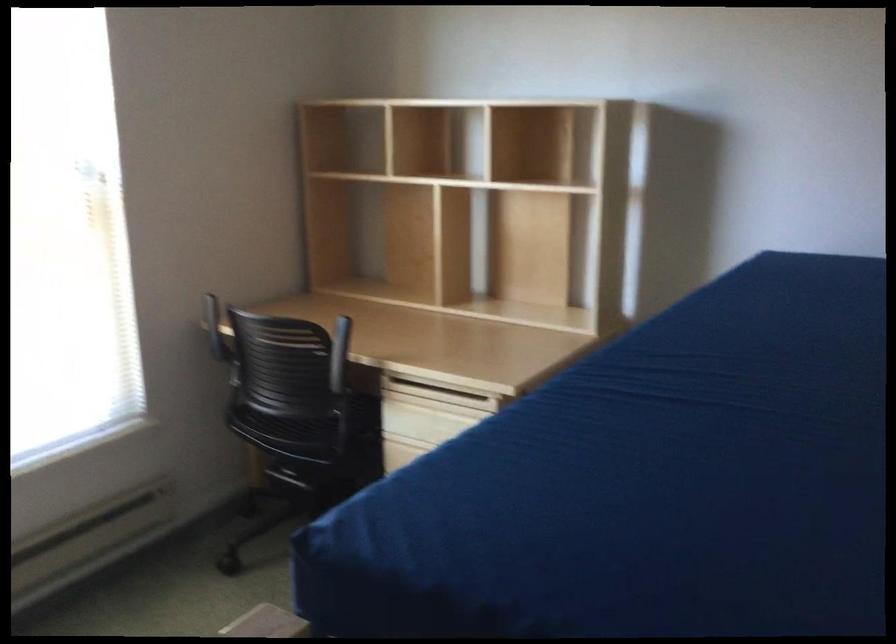
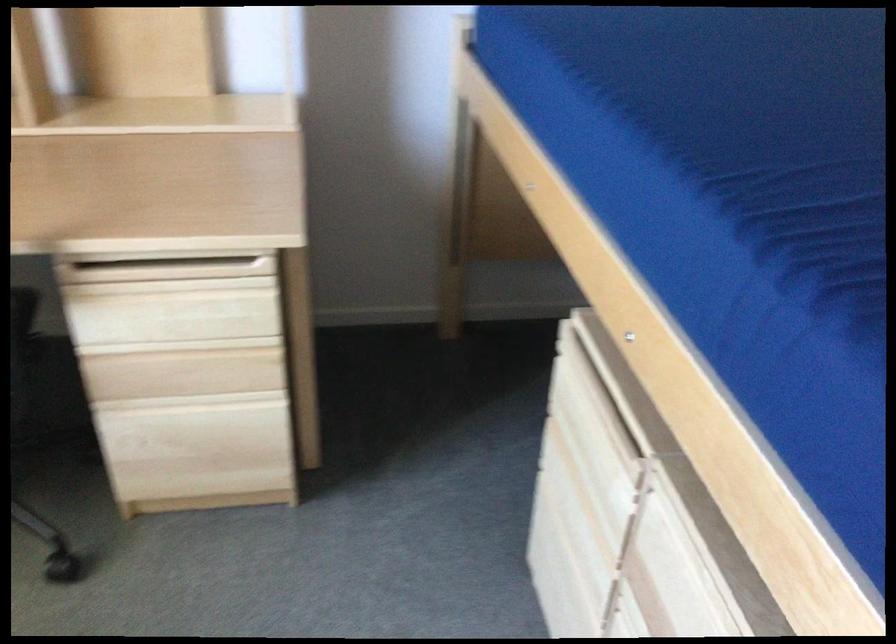
In the second image, find the point that corresponds to the point at 435,395 in the first image.

(166, 270)